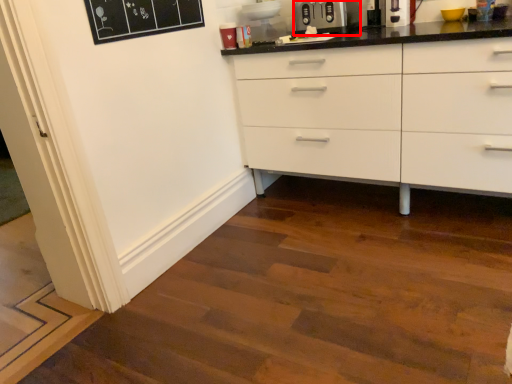
Question: In this image, where is appliance (annotated by the red box) located relative to coffee machine?

Choices:
 (A) right
 (B) left

Answer: (B)